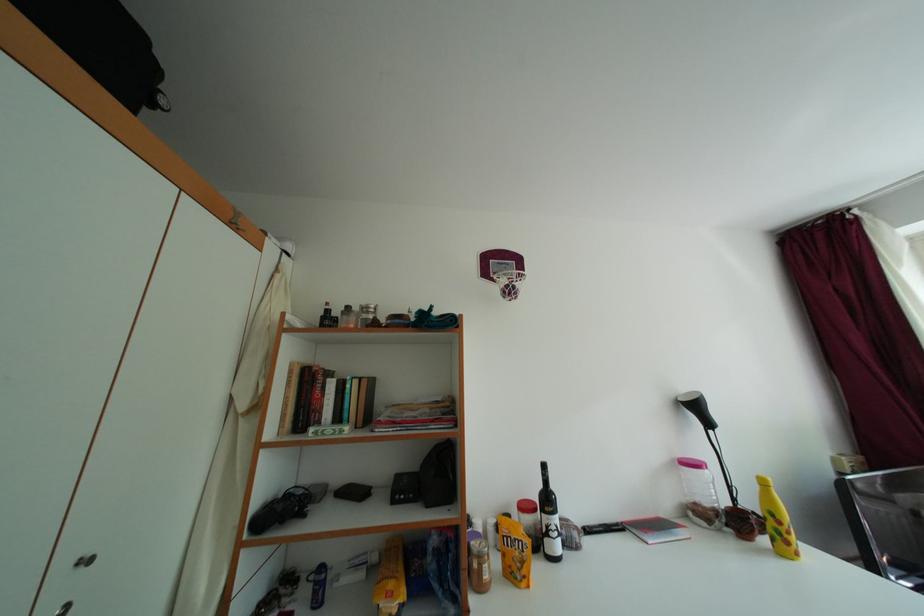
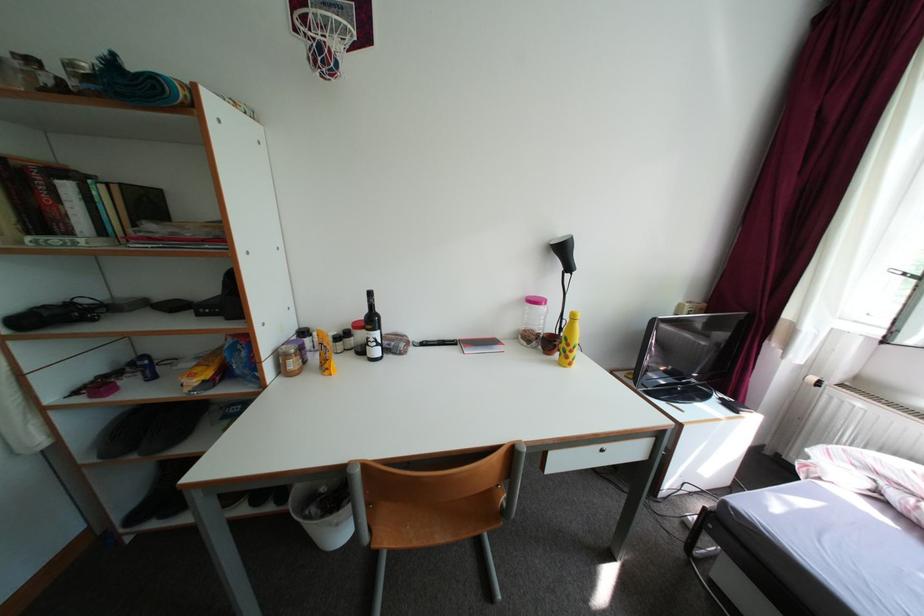
Question: The images are taken continuously from a first-person perspective. In which direction is your viewpoint rotating?

Choices:
 (A) Left
 (B) Right
 (C) Up
 (D) Down

Answer: (D)